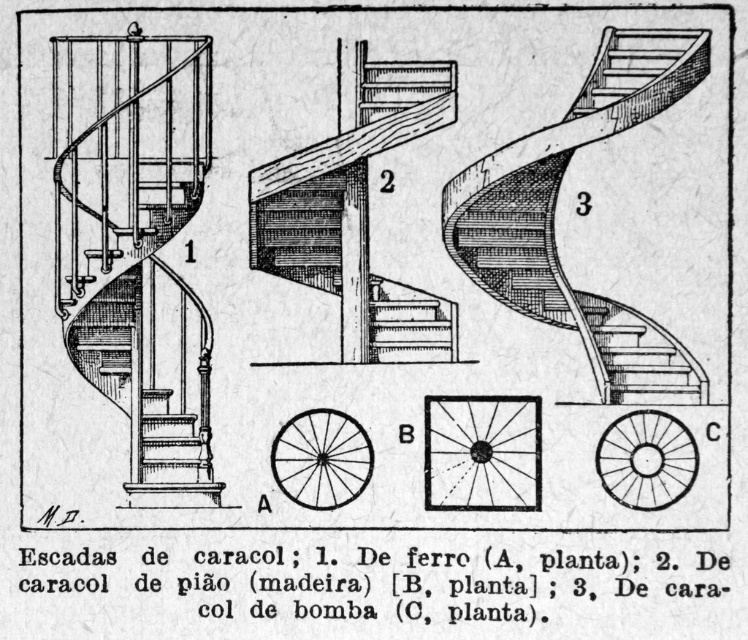
Who is positioned more to the right, transparent glass sunburst at center or black wood spiral staircase at center?

black wood spiral staircase at center

The height and width of the screenshot is (640, 748). What do you see at coordinates (482, 452) in the screenshot?
I see `transparent glass sunburst at center` at bounding box center [482, 452].

Where is `transparent glass sunburst at center`? The height and width of the screenshot is (640, 748). transparent glass sunburst at center is located at coordinates (482, 452).

Does transparent glass sunburst at center have a greater height compared to wooden stairs at center?

Yes, transparent glass sunburst at center is taller than wooden stairs at center.

Which is behind, point (524, 428) or point (429, 349)?

Positioned behind is point (429, 349).

Measure the distance between point [512,509] and camera.

Point [512,509] and camera are 17.38 feet apart from each other.

The height and width of the screenshot is (640, 748). What are the coordinates of `transparent glass sunburst at center` in the screenshot? It's located at (482, 452).

Measure the distance between point (654,484) and camera.

A distance of 5.35 meters exists between point (654,484) and camera.

Image resolution: width=748 pixels, height=640 pixels. Identify the location of black wood spiral staircase at center. (646, 460).